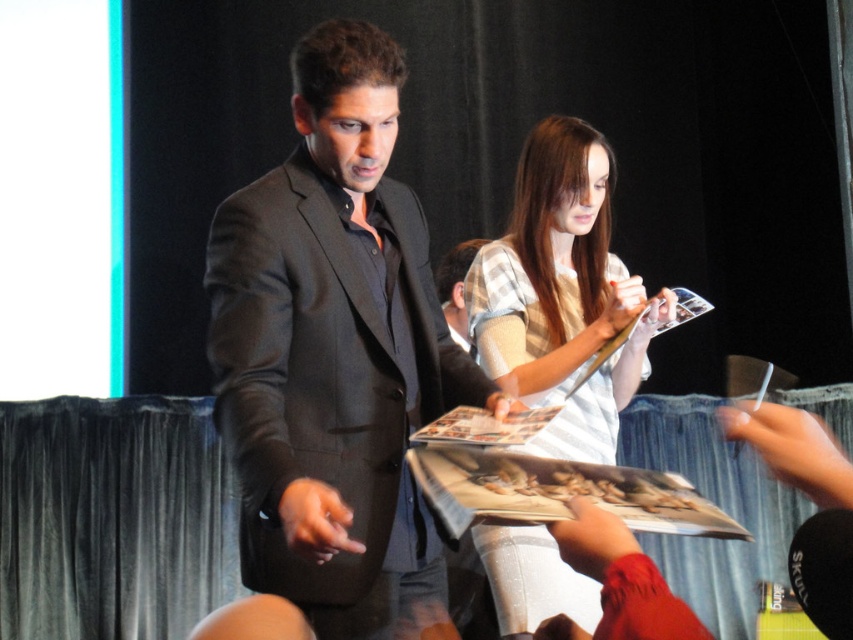
You are a photographer standing at the back of the event venue. You want to take a clear photo of the matte black suit at center. Considering your current position, can you estimate if you are within the recommended 5 feet focus range for your camera?

The matte black suit at center is 4.60 feet away from the camera, which is within the recommended 5 feet focus range. Therefore, you can take a clear photo.

You are attending a signing event and notice two people at the center of the stage. One is wearing a matte black suit at center and the other a light beige plaid shirt at center. From your perspective facing the stage, which clothing item is positioned to the left?

The matte black suit at center is to the left of the light beige plaid shirt at center.

You are a photographer at this event and need to adjust the camera focus. The minimum focus distance for your lens is 18 inches. Can you focus on both the matte black suit at center and the light beige plaid shirt at center simultaneously without moving the camera?

The distance between the matte black suit at center and the light beige plaid shirt at center is 18.20 inches. Since the minimum focus distance is 18 inches, the 0.20 inch difference means the camera can focus on both objects simultaneously as the distance is just over the minimum requirement.